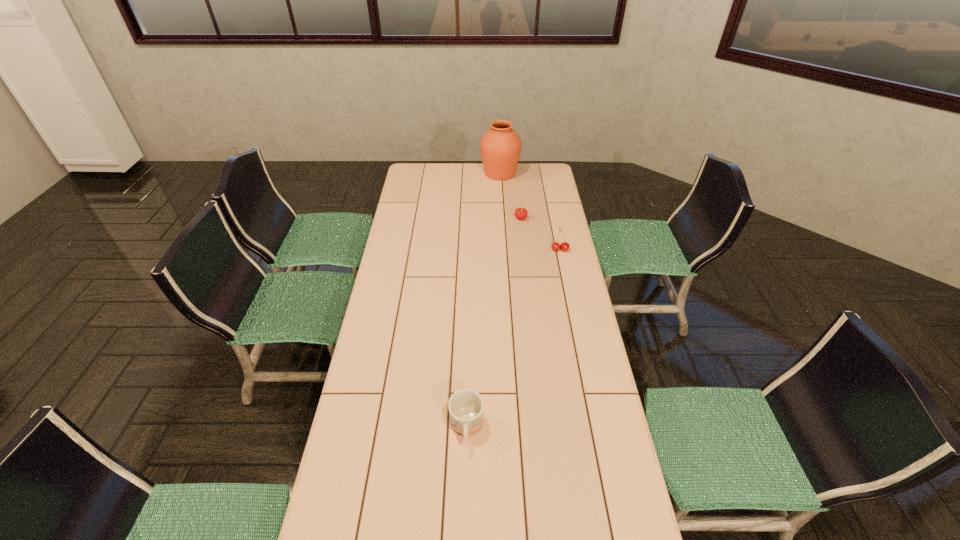
The width and height of the screenshot is (960, 540). I want to click on the tallest object, so point(500,146).

You are a GUI agent. You are given a task and a screenshot of the screen. Output one action in this format:
    pyautogui.click(x=<x>, y=<y>)
    Task: Click on the urn
    
    Given the screenshot: What is the action you would take?
    pyautogui.click(x=500, y=146)

Find the location of `the left cherry`. the left cherry is located at coordinates (521, 213).

The image size is (960, 540). I want to click on the farther cherry, so click(521, 213).

Identify the location of the second nearest object. The height and width of the screenshot is (540, 960). (555, 246).

This screenshot has width=960, height=540. Find the location of `the rightmost object`. the rightmost object is located at coordinates (555, 246).

You are a GUI agent. You are given a task and a screenshot of the screen. Output one action in this format:
    pyautogui.click(x=<x>, y=<y>)
    Task: Click on the mug
    This screenshot has width=960, height=540.
    Given the screenshot: What is the action you would take?
    pyautogui.click(x=466, y=406)

Find the location of a particular element. The image size is (960, 540). free space located 0.170m on the front of the tallest object is located at coordinates (502, 201).

Identify the location of blank space located 0.140m on the right of the third nearest object. Image resolution: width=960 pixels, height=540 pixels. (557, 218).

The height and width of the screenshot is (540, 960). In order to click on vacant space located 0.100m with the stems of the third farthest object pointing upwards in this screenshot , I will do `click(564, 268)`.